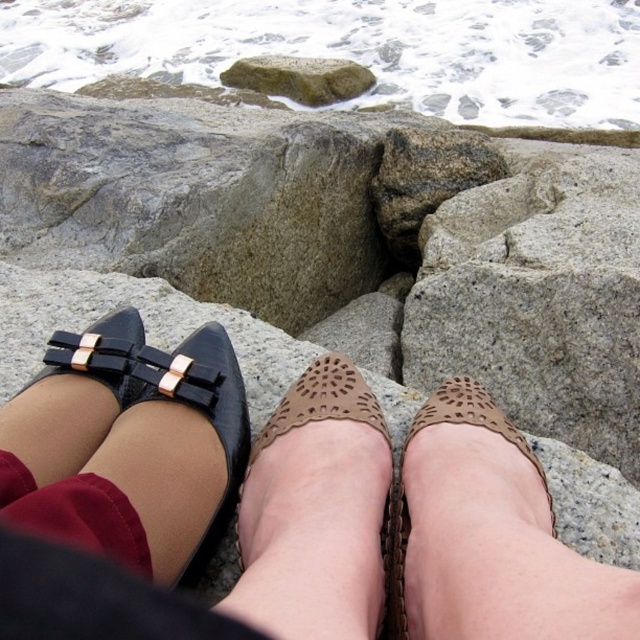
I want to click on brown perforated shoe at center, so point(488,536).

At what (x,y) coordinates should I click in order to perform the action: click on brown perforated shoe at center. Please return your answer as a coordinate pair (x, y). The image size is (640, 640). Looking at the image, I should click on (488, 536).

Image resolution: width=640 pixels, height=640 pixels. Identify the location of brown perforated shoe at center. (488, 536).

Image resolution: width=640 pixels, height=640 pixels. What do you see at coordinates (488, 536) in the screenshot?
I see `brown perforated shoe at center` at bounding box center [488, 536].

At what (x,y) coordinates should I click in order to perform the action: click on brown perforated shoe at center. Please return your answer as a coordinate pair (x, y). Looking at the image, I should click on (488, 536).

Is point (320, 516) closer to viewer compared to point (140, 520)?

No, (320, 516) is behind (140, 520).

You are a GUI agent. You are given a task and a screenshot of the screen. Output one action in this format:
    pyautogui.click(x=<x>, y=<y>)
    Task: Click on the brown leather shoe at center
    
    Given the screenshot: What is the action you would take?
    pyautogui.click(x=316, y=509)

Where is `brown leather shoe at center`? Image resolution: width=640 pixels, height=640 pixels. brown leather shoe at center is located at coordinates (316, 509).